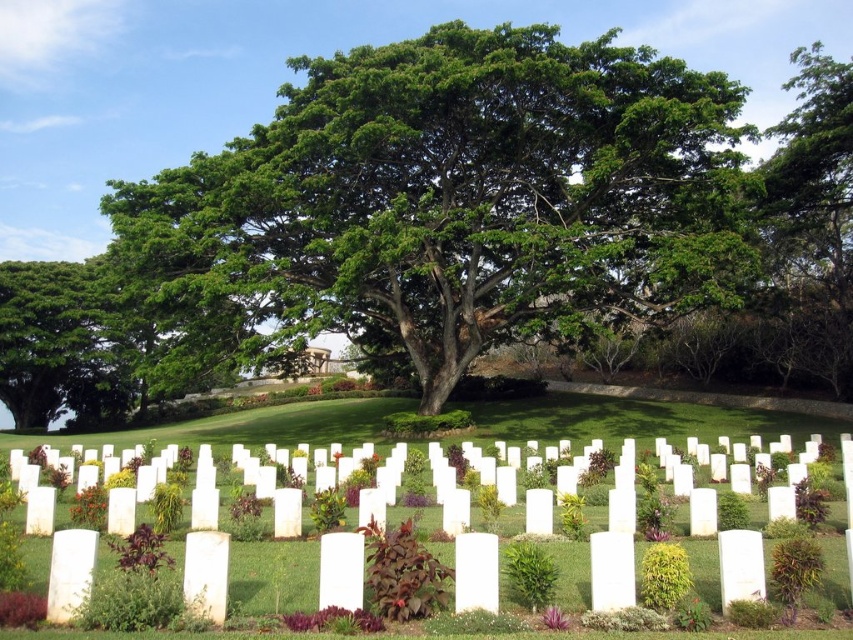
Image resolution: width=853 pixels, height=640 pixels. What do you see at coordinates (450, 208) in the screenshot?
I see `green leafy tree at center` at bounding box center [450, 208].

Can you confirm if green leafy tree at center is shorter than white matte headstones at center?

In fact, green leafy tree at center may be taller than white matte headstones at center.

You are a GUI agent. You are given a task and a screenshot of the screen. Output one action in this format:
    pyautogui.click(x=<x>, y=<y>)
    Task: Click on the green leafy tree at center
    Image resolution: width=853 pixels, height=640 pixels.
    Given the screenshot: What is the action you would take?
    pyautogui.click(x=450, y=208)

Locate an element on the screen. The image size is (853, 640). green leafy tree at center is located at coordinates pyautogui.click(x=450, y=208).